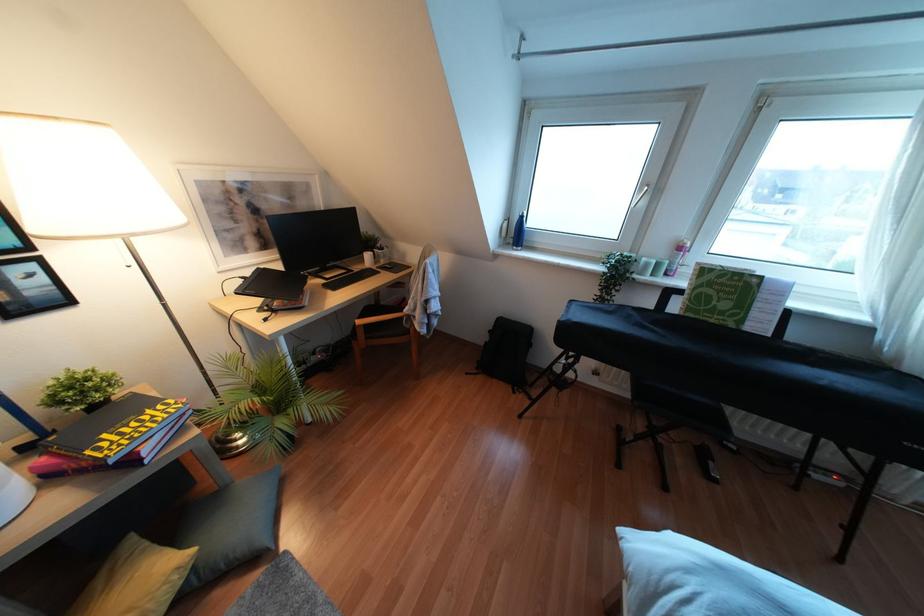
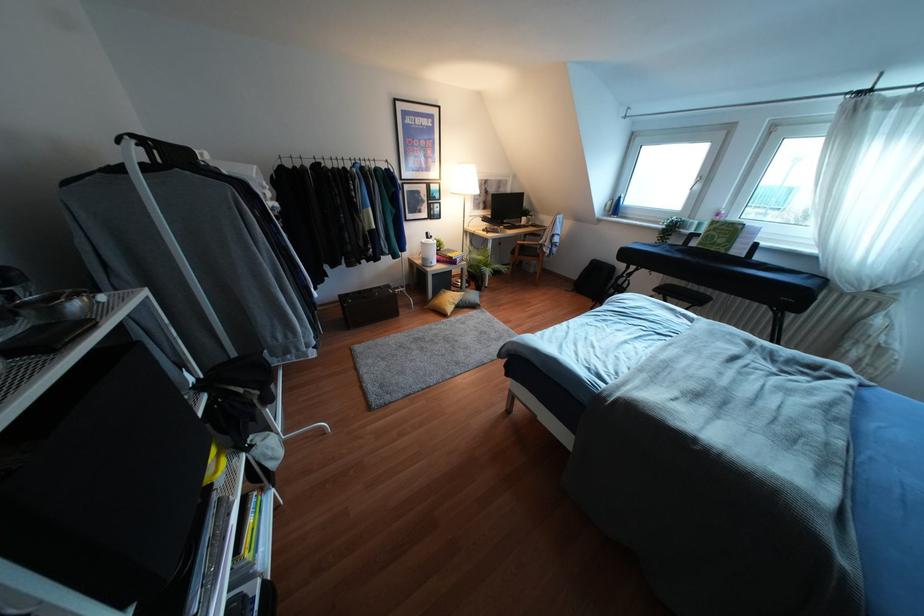
Locate, in the second image, the point that corresponds to (x=98, y=578) in the first image.

(441, 292)